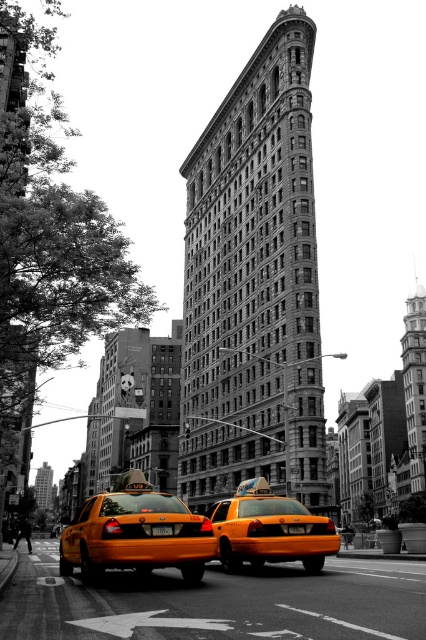
Does yellow matte taxi at lower center have a lesser width compared to shiny yellow taxi at center?

No.

Is the position of yellow matte taxi at lower center more distant than that of shiny yellow taxi at center?

No, it is not.

Describe the element at coordinates (135, 532) in the screenshot. I see `yellow matte taxi at lower center` at that location.

Identify the location of yellow matte taxi at lower center. (135, 532).